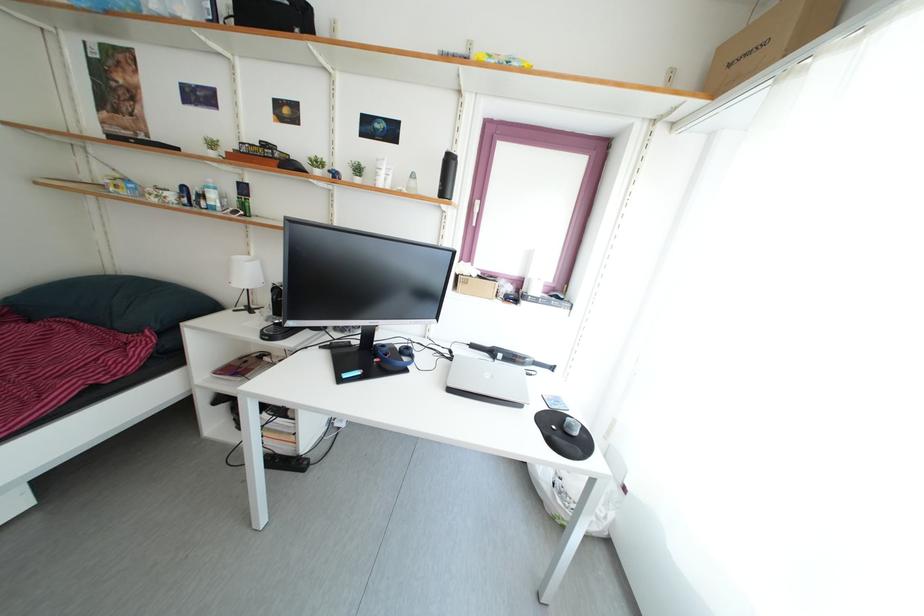
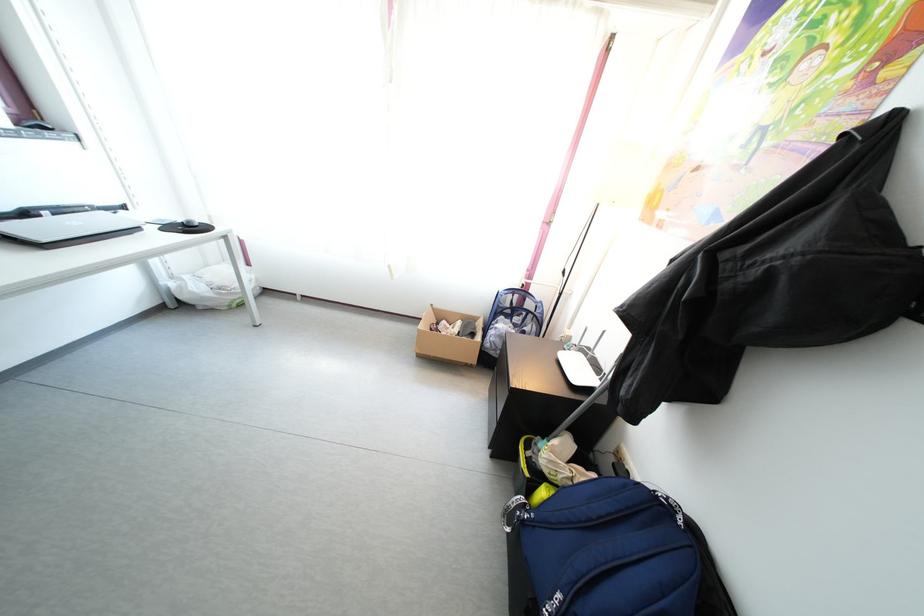
Where in the second image is the point corresponding to (x=544, y=493) from the first image?

(210, 306)